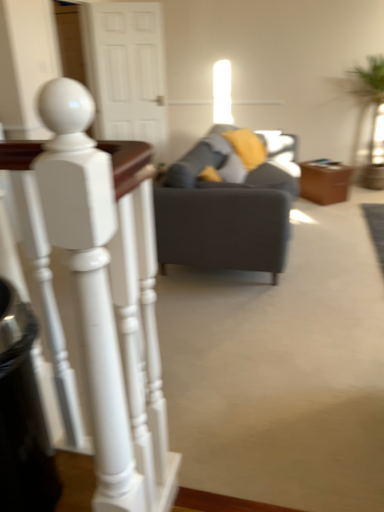
Question: Is brown leather side table at center taller than black plastic trash can at lower left?

Choices:
 (A) no
 (B) yes

Answer: (A)

Question: From the image's perspective, is brown leather side table at center beneath black plastic trash can at lower left?

Choices:
 (A) yes
 (B) no

Answer: (B)

Question: Is brown leather side table at center further to camera compared to black plastic trash can at lower left?

Choices:
 (A) yes
 (B) no

Answer: (A)

Question: Is brown leather side table at center thinner than black plastic trash can at lower left?

Choices:
 (A) yes
 (B) no

Answer: (B)

Question: Is brown leather side table at center located outside black plastic trash can at lower left?

Choices:
 (A) yes
 (B) no

Answer: (A)

Question: From the image's perspective, is white glossy staircase railing at left located above or below brown leather side table at center?

Choices:
 (A) above
 (B) below

Answer: (B)

Question: Does point (140, 379) appear closer or farther from the camera than point (311, 199)?

Choices:
 (A) closer
 (B) farther

Answer: (A)

Question: Relative to brown leather side table at center, is white glossy staircase railing at left in front or behind?

Choices:
 (A) behind
 (B) front

Answer: (B)

Question: Do you think white glossy staircase railing at left is within brown leather side table at center, or outside of it?

Choices:
 (A) inside
 (B) outside

Answer: (B)

Question: In terms of size, does black plastic trash can at lower left appear bigger or smaller than green leafy plant at right?

Choices:
 (A) small
 (B) big

Answer: (A)

Question: Considering the positions of point (8, 494) and point (380, 71), is point (8, 494) closer or farther from the camera than point (380, 71)?

Choices:
 (A) farther
 (B) closer

Answer: (B)

Question: Is black plastic trash can at lower left inside or outside of green leafy plant at right?

Choices:
 (A) inside
 (B) outside

Answer: (B)

Question: Would you say black plastic trash can at lower left is to the left or to the right of green leafy plant at right in the picture?

Choices:
 (A) right
 (B) left

Answer: (B)

Question: From a real-world perspective, is brown leather side table at center physically located above or below white glossy staircase railing at left?

Choices:
 (A) above
 (B) below

Answer: (B)

Question: In terms of size, does brown leather side table at center appear bigger or smaller than white glossy staircase railing at left?

Choices:
 (A) small
 (B) big

Answer: (B)